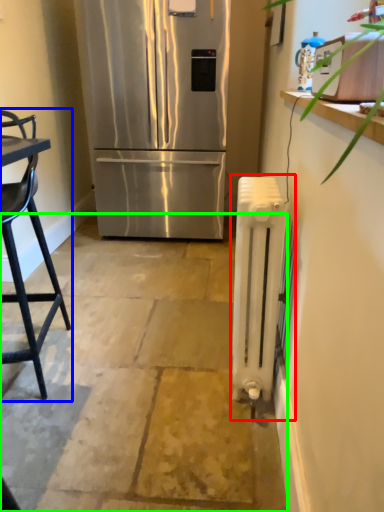
Question: Which object is positioned farthest from radiator (highlighted by a red box)? Select from chair (highlighted by a blue box) and concrete (highlighted by a green box).

Choices:
 (A) chair
 (B) concrete

Answer: (A)